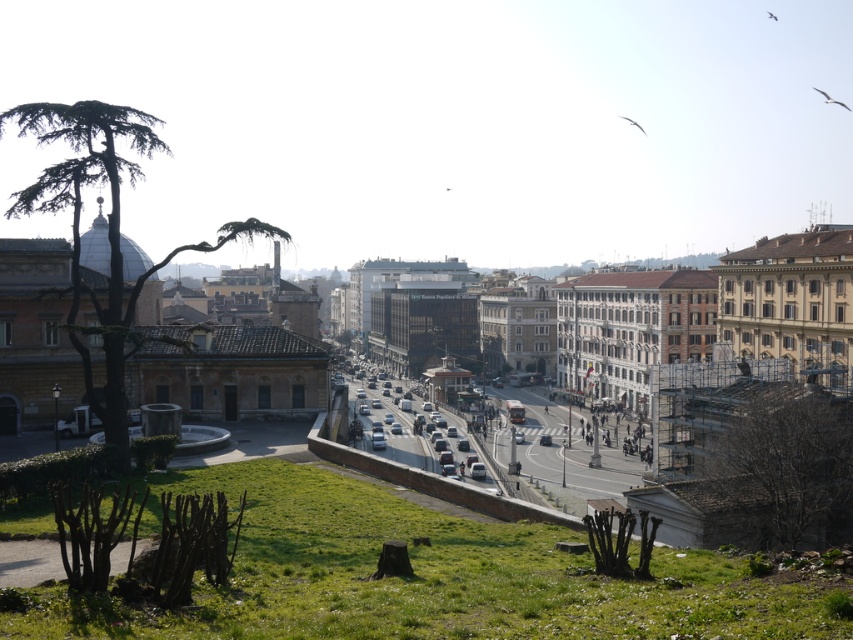
You are a city planner evaluating the urban layout. Considering the green leafy palm tree at left and the silver metallic car at center, which object occupies more space in the image?

The green leafy palm tree at left is larger in size than the silver metallic car at center, so it occupies more space in the image.

You are a delivery drone operator. Your drone needs to fly from the green leafy palm tree at left to the silver metallic car at center. What is the approximate distance your drone must cover?

The distance between the green leafy palm tree at left and the silver metallic car at center is approximately 39.87 meters, so the drone must cover roughly 40 meters.

You are a pedestrian standing on the grassy hill and want to cross the road to reach the palm tree. Which direction should you walk to get to the green leafy palm tree at left from the silver metallic car at center?

The green leafy palm tree at left is to the left of the silver metallic car at center, so you should walk to the left to reach it.